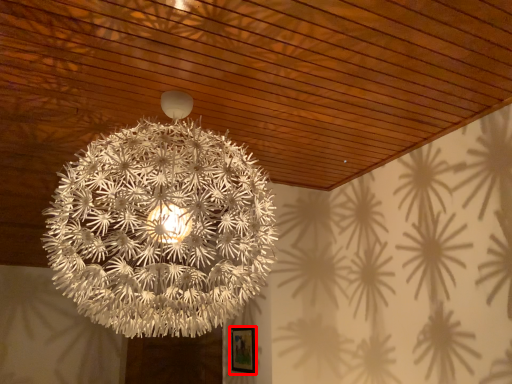
Question: From the image's perspective, where is picture frame (annotated by the red box) located relative to lamp?

Choices:
 (A) below
 (B) above

Answer: (A)